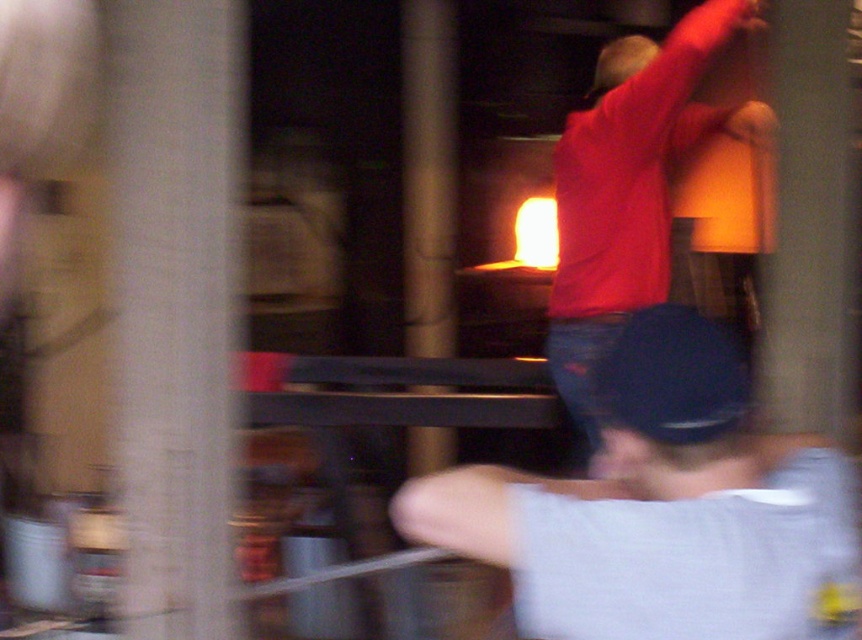
Consider the image. Between dark blue jeans at center and black matte baseball hat at center, which one is positioned lower?

Positioned lower is dark blue jeans at center.

Who is shorter, dark blue jeans at center or black matte baseball hat at center?

black matte baseball hat at center

Is point (451, 528) positioned behind point (642, 387)?

That is True.

Locate an element on the screen. dark blue jeans at center is located at coordinates click(661, 508).

Between matte red shirt at center and black matte baseball hat at center, which one appears on the left side from the viewer's perspective?

black matte baseball hat at center

Is matte red shirt at center above black matte baseball hat at center?

Yes, matte red shirt at center is above black matte baseball hat at center.

Who is more forward, (572,122) or (689,358)?

Positioned in front is point (689,358).

Image resolution: width=862 pixels, height=640 pixels. What are the coordinates of `matte red shirt at center` in the screenshot? It's located at 629,186.

Is dark blue jeans at center above matte red shirt at center?

No, dark blue jeans at center is not above matte red shirt at center.

Between dark blue jeans at center and matte red shirt at center, which one is positioned lower?

Positioned lower is dark blue jeans at center.

Does point (667, 504) come behind point (608, 77)?

No, (667, 504) is closer to viewer.

The width and height of the screenshot is (862, 640). Identify the location of dark blue jeans at center. (661, 508).